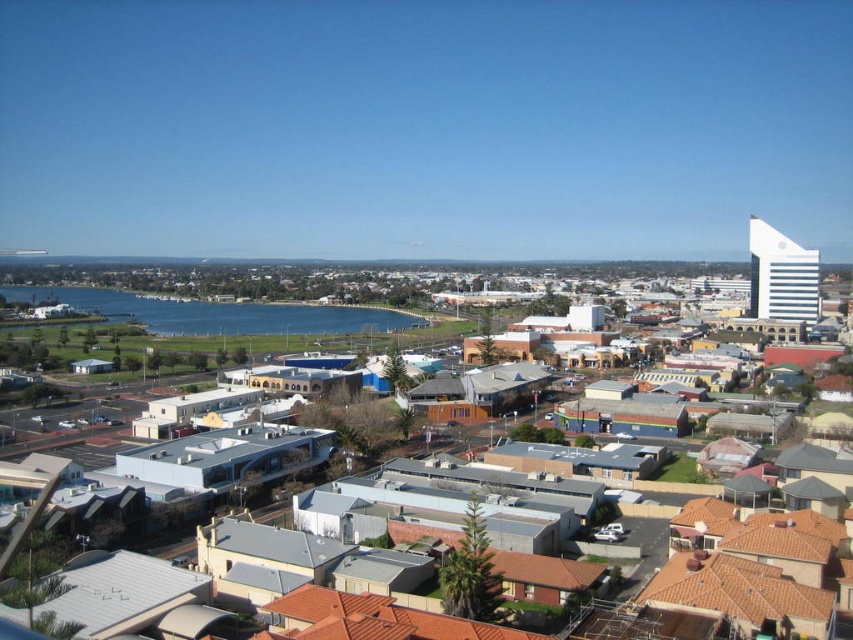
Is blue water at center positioned in front of gray concrete buildings at center?

No, it is behind gray concrete buildings at center.

Who is more forward, (218, 326) or (427, 508)?

Positioned in front is point (427, 508).

You are a GUI agent. You are given a task and a screenshot of the screen. Output one action in this format:
    pyautogui.click(x=<x>, y=<y>)
    Task: Click on the blue water at center
    Image resolution: width=853 pixels, height=640 pixels.
    Given the screenshot: What is the action you would take?
    pyautogui.click(x=218, y=314)